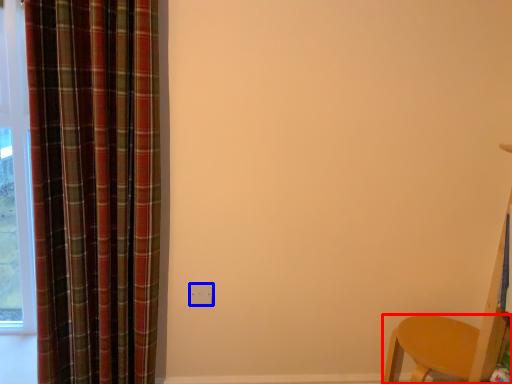
Question: Which object is further to the camera taking this photo, furniture (highlighted by a red box) or electric outlet (highlighted by a blue box)?

Choices:
 (A) furniture
 (B) electric outlet

Answer: (B)